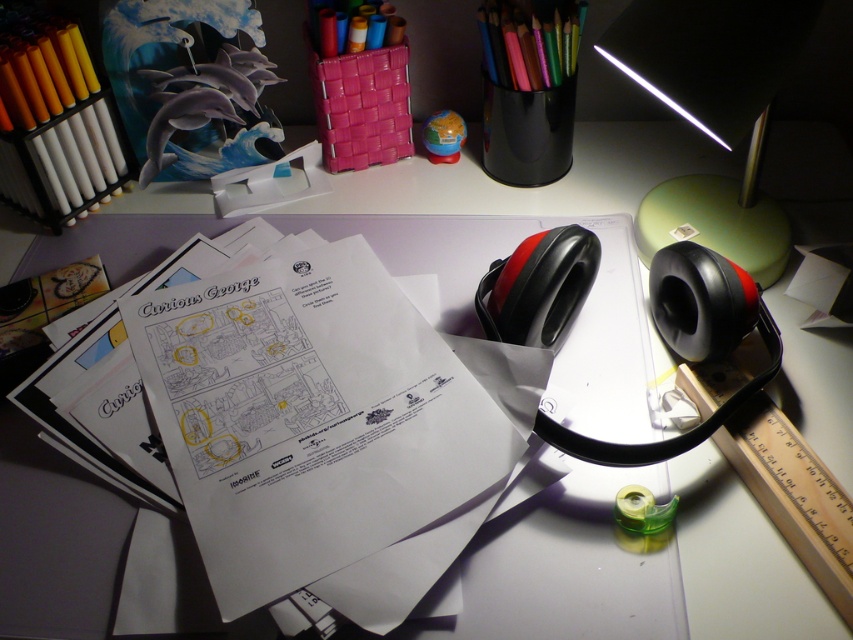
Does white paper at center have a greater width compared to colored pencils at upper right?

Correct, the width of white paper at center exceeds that of colored pencils at upper right.

Who is higher up, white paper at center or colored pencils at upper right?

colored pencils at upper right

Which is behind, point (352, 332) or point (508, 16)?

The point (508, 16) is behind.

Locate an element on the screen. white paper at center is located at coordinates (328, 429).

Can you confirm if matte yellow pencil at upper left is thinner than colored pencils at upper right?

Indeed, matte yellow pencil at upper left has a lesser width compared to colored pencils at upper right.

Which of these two, matte yellow pencil at upper left or colored pencils at upper right, stands shorter?

colored pencils at upper right is shorter.

Who is more distant from viewer, (9, 45) or (483, 19)?

The point (483, 19) is behind.

You are a GUI agent. You are given a task and a screenshot of the screen. Output one action in this format:
    pyautogui.click(x=<x>, y=<y>)
    Task: Click on the matte yellow pencil at upper left
    
    Given the screenshot: What is the action you would take?
    pyautogui.click(x=41, y=70)

Is point (735, 227) closer to camera compared to point (347, 35)?

Yes, it is in front of point (347, 35).

What do you see at coordinates (712, 113) in the screenshot? I see `green matte lamp at upper right` at bounding box center [712, 113].

Which is behind, point (786, 56) or point (370, 40)?

Positioned behind is point (370, 40).

This screenshot has width=853, height=640. I want to click on green matte lamp at upper right, so click(712, 113).